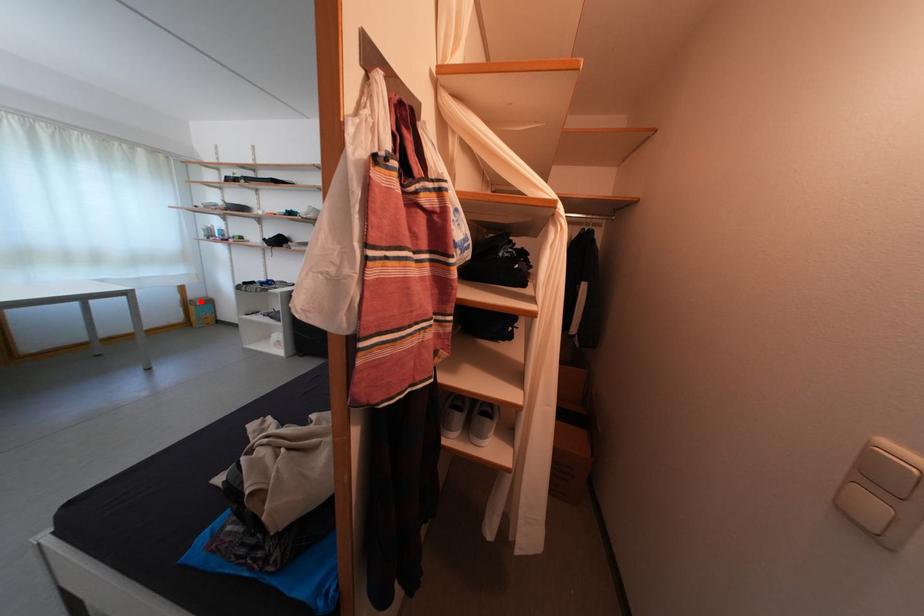
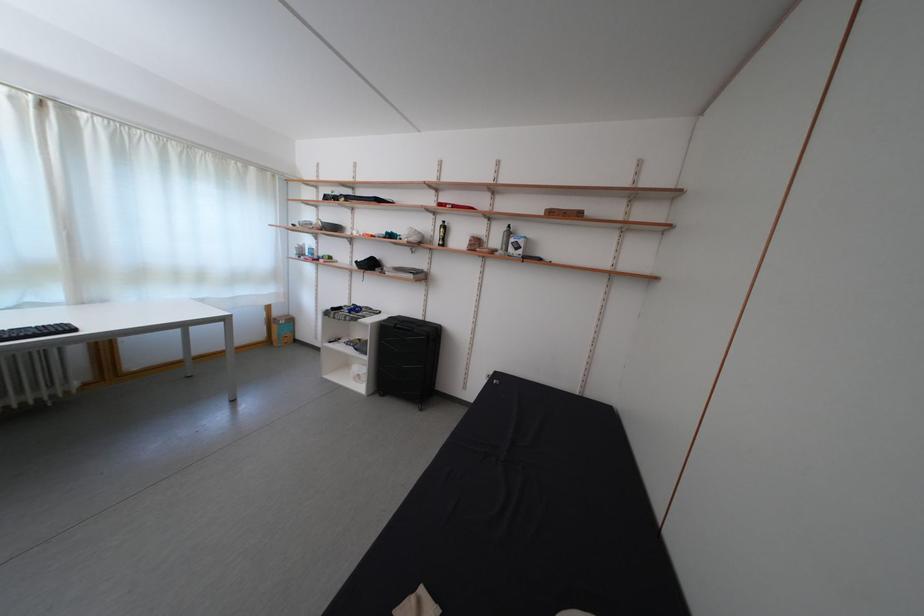
The point at the highlighted location is marked in the first image. Where is the corresponding point in the second image?

(285, 320)